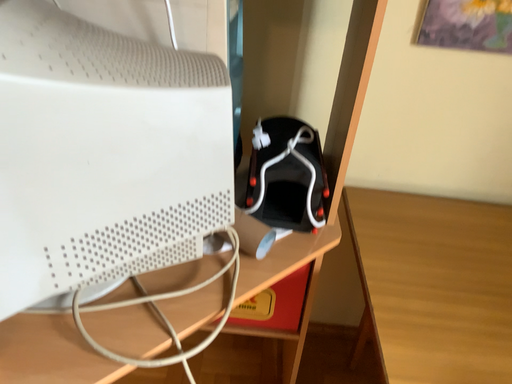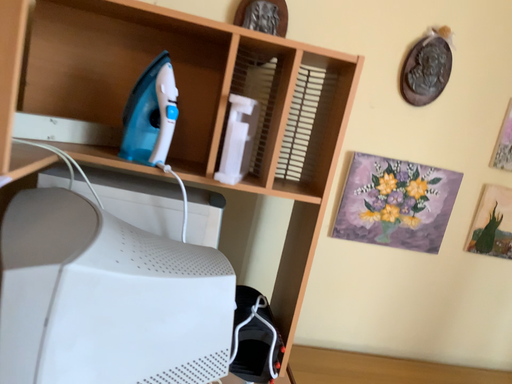
Question: How did the camera likely rotate when shooting the video?

Choices:
 (A) rotated right
 (B) rotated left

Answer: (A)